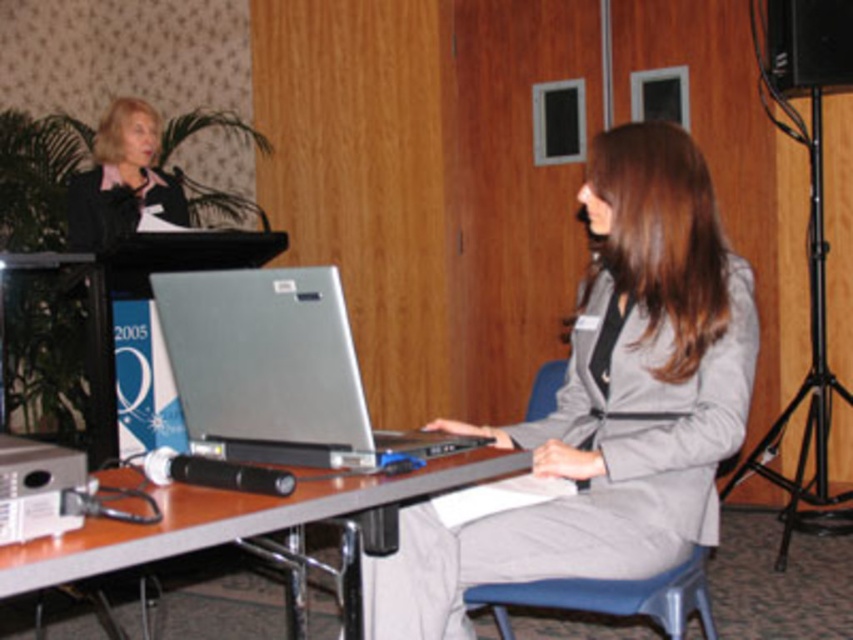
Question: Can you confirm if silver metallic laptop at center is wider than matte black suit at upper left?

Choices:
 (A) no
 (B) yes

Answer: (B)

Question: Which object appears closest to the camera in this image?

Choices:
 (A) gray fabric suit at center
 (B) blue plastic chair at lower center
 (C) metallic gray table at center
 (D) matte black suit at upper left

Answer: (C)

Question: Which of the following is the farthest from the observer?

Choices:
 (A) (434, 422)
 (B) (689, 580)
 (C) (793, 17)
 (D) (358, 499)

Answer: (C)

Question: Is metallic gray table at center wider than black matte speaker at upper right?

Choices:
 (A) no
 (B) yes

Answer: (B)

Question: Which of these objects is positioned farthest from the silver metallic laptop at center?

Choices:
 (A) matte black suit at upper left
 (B) black matte speaker at upper right
 (C) metallic gray table at center

Answer: (B)

Question: Is metallic gray table at center positioned before black matte speaker at upper right?

Choices:
 (A) no
 (B) yes

Answer: (B)